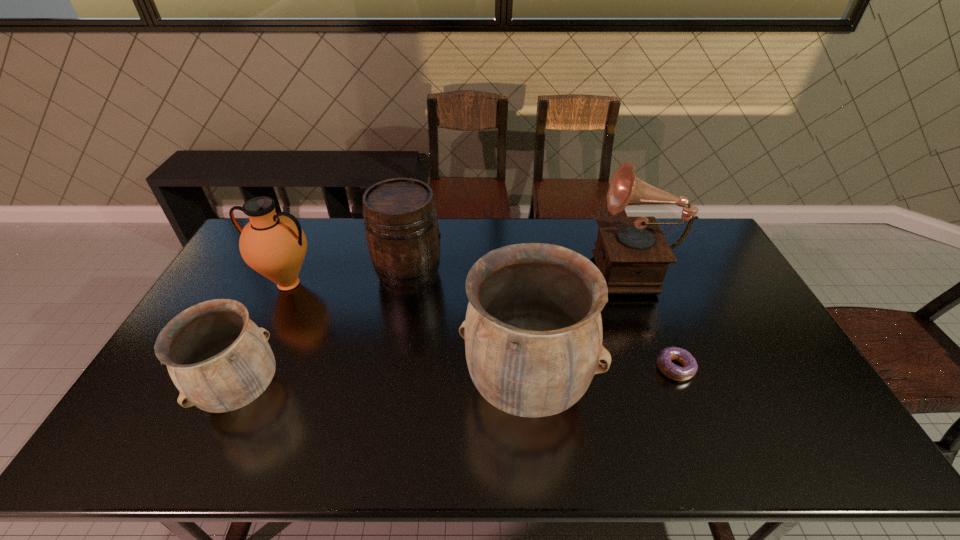
Locate which object ranks fifth in proximity to the left urn. Please provide its 2D coordinates. Your answer should be formatted as a tuple, i.e. [(x, y)], where the tuple contains the x and y coordinates of a point satisfying the conditions above.

[(664, 363)]

You are a GUI agent. You are given a task and a screenshot of the screen. Output one action in this format:
    pyautogui.click(x=<x>, y=<y>)
    Task: Click on the vacant region that satisfies the following two spatial constraints: 1. on the side of the fourth object from right to left near the bung hole; 2. on the left side of the taller urn
    The height and width of the screenshot is (540, 960).
    Given the screenshot: What is the action you would take?
    pyautogui.click(x=389, y=387)

Locate an element on the screen. Image resolution: width=960 pixels, height=540 pixels. vacant region that satisfies the following two spatial constraints: 1. on the side of the cider near the bung hole; 2. on the right side of the doughnut is located at coordinates (393, 368).

Identify the location of free space that satisfies the following two spatial constraints: 1. on the side of the third object from left to right near the bung hole; 2. on the front side of the pitcher. This screenshot has width=960, height=540. (407, 284).

Find the location of a particular element. vacant space that satisfies the following two spatial constraints: 1. on the horn of the record player; 2. on the left side of the doughnut is located at coordinates (671, 368).